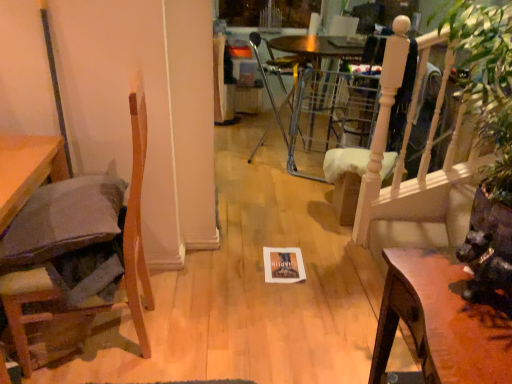
Question: Should I look upward or downward to see wooden table at lower right?

Choices:
 (A) up
 (B) down

Answer: (B)

Question: Considering the relative sizes of wooden chair at left, marked as the 1th chair in a front-to-back arrangement, and wooden table at lower right in the image provided, is wooden chair at left, marked as the 1th chair in a front-to-back arrangement, wider than wooden table at lower right?

Choices:
 (A) yes
 (B) no

Answer: (A)

Question: From the image's perspective, is wooden chair at left, the 2th chair from the back, located beneath wooden table at lower right?

Choices:
 (A) yes
 (B) no

Answer: (B)

Question: Is wooden chair at left, marked as the 1th chair in a left-to-right arrangement, thinner than wooden table at lower right?

Choices:
 (A) no
 (B) yes

Answer: (A)

Question: Would you say wooden table at lower right is part of wooden chair at left, marked as the 1th chair in a left-to-right arrangement,'s contents?

Choices:
 (A) no
 (B) yes

Answer: (A)

Question: Can you confirm if wooden chair at left, the 2th chair in the top-to-bottom sequence, is positioned to the left of wooden table at lower right?

Choices:
 (A) yes
 (B) no

Answer: (A)

Question: Is wooden chair at left, which is counted as the 2th chair, starting from the right, touching wooden table at lower right?

Choices:
 (A) no
 (B) yes

Answer: (A)

Question: From the image's perspective, is metallic silver chair at center, which is the first chair in right-to-left order, on wooden chair at left, marked as the 1th chair in a left-to-right arrangement?

Choices:
 (A) no
 (B) yes

Answer: (B)

Question: Is wooden chair at left, marked as the 1th chair in a left-to-right arrangement, at the back of metallic silver chair at center, which appears as the first chair when viewed from the back?

Choices:
 (A) no
 (B) yes

Answer: (A)

Question: Is metallic silver chair at center, positioned as the first chair in top-to-bottom order, placed right next to wooden chair at left, the 2th chair from the back?

Choices:
 (A) no
 (B) yes

Answer: (A)

Question: Is metallic silver chair at center, which is the first chair in right-to-left order, not inside wooden chair at left, the 2th chair from the back?

Choices:
 (A) yes
 (B) no

Answer: (A)

Question: Can you confirm if metallic silver chair at center, positioned as the 2th chair in front-to-back order, is taller than wooden chair at left, the 2th chair in the top-to-bottom sequence?

Choices:
 (A) no
 (B) yes

Answer: (A)

Question: Is metallic silver chair at center, which is the first chair in right-to-left order, far from wooden chair at left, the 1th chair in the bottom-to-top sequence?

Choices:
 (A) yes
 (B) no

Answer: (A)

Question: Is metallic silver chair at center, positioned as the first chair in top-to-bottom order, at the back of wooden chair at left, the 2th chair from the back?

Choices:
 (A) no
 (B) yes

Answer: (A)